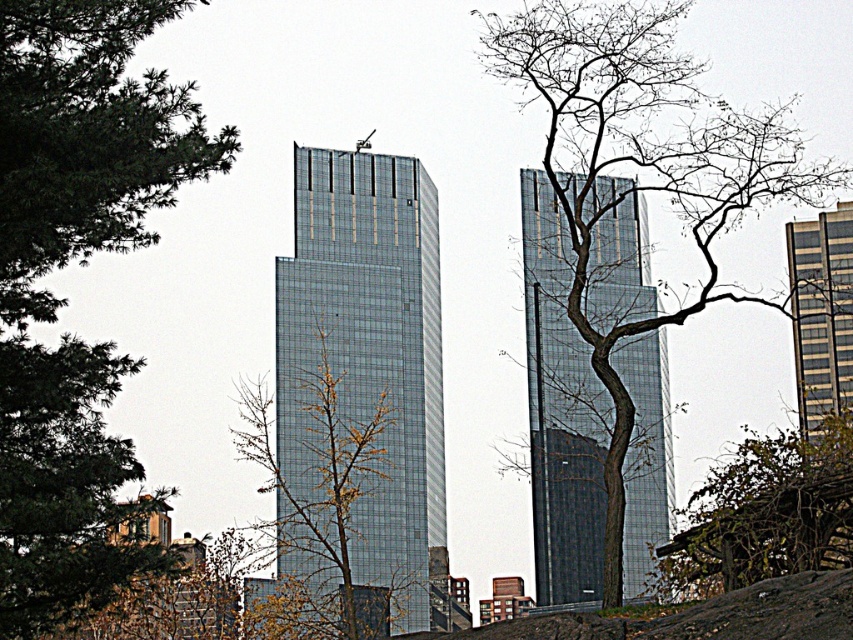
Is green leafy tree at left positioned at the back of glassy reflective skyscraper at center?

No, green leafy tree at left is in front of glassy reflective skyscraper at center.

Is point (33, 138) farther from viewer compared to point (625, 284)?

No, it is in front of (625, 284).

The image size is (853, 640). Find the location of `green leafy tree at left`. green leafy tree at left is located at coordinates (65, 264).

Consider the image. Is green leafy tree at left bigger than bare branches at center?

Actually, green leafy tree at left might be smaller than bare branches at center.

Can you confirm if green leafy tree at left is taller than bare branches at center?

In fact, green leafy tree at left may be shorter than bare branches at center.

Does point (134, 214) come in front of point (834, 163)?

Yes.

Where is `green leafy tree at left`? The image size is (853, 640). green leafy tree at left is located at coordinates (65, 264).

Is green leafy tree at left shorter than green leafy tree at lower right?

No.

Does green leafy tree at left appear on the left side of green leafy tree at lower right?

Yes, green leafy tree at left is to the left of green leafy tree at lower right.

The height and width of the screenshot is (640, 853). Identify the location of green leafy tree at left. (65, 264).